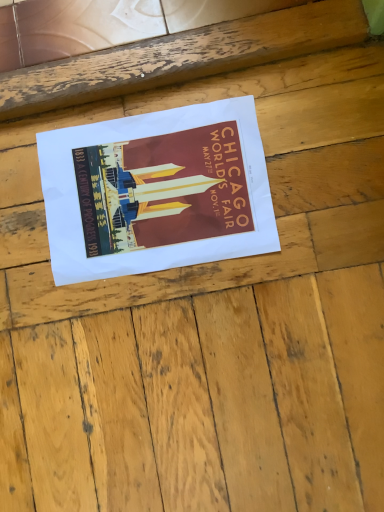
You are a GUI agent. You are given a task and a screenshot of the screen. Output one action in this format:
    pyautogui.click(x=<x>, y=<y>)
    Task: Click on the matte paper poster at center
    This screenshot has height=512, width=384.
    Given the screenshot: What is the action you would take?
    pyautogui.click(x=156, y=191)

The height and width of the screenshot is (512, 384). Describe the element at coordinates (156, 191) in the screenshot. I see `matte paper poster at center` at that location.

What do you see at coordinates (203, 402) in the screenshot? This screenshot has height=512, width=384. I see `wooden at center` at bounding box center [203, 402].

The width and height of the screenshot is (384, 512). In order to click on wooden at center in this screenshot , I will do `click(203, 402)`.

What is the approximate height of wooden at center?

It is 1.77 centimeters.

You are a GUI agent. You are given a task and a screenshot of the screen. Output one action in this format:
    pyautogui.click(x=<x>, y=<y>)
    Task: Click on the matte paper poster at center
    This screenshot has width=384, height=512.
    Given the screenshot: What is the action you would take?
    pyautogui.click(x=156, y=191)

Looking at this image, is matte paper poster at center to the right of wooden at center from the viewer's perspective?

In fact, matte paper poster at center is to the left of wooden at center.

Which is in front, matte paper poster at center or wooden at center?

wooden at center is in front.

Considering the points (99, 207) and (234, 399), which point is in front, point (99, 207) or point (234, 399)?

Positioned in front is point (234, 399).

From the image's perspective, is matte paper poster at center above or below wooden at center?

Based on their image positions, matte paper poster at center is located above wooden at center.

From a real-world perspective, relative to wooden at center, is matte paper poster at center vertically above or below?

matte paper poster at center is below wooden at center.

Considering the relative sizes of matte paper poster at center and wooden at center in the image provided, is matte paper poster at center thinner than wooden at center?

Yes, matte paper poster at center is thinner than wooden at center.

Is matte paper poster at center shorter than wooden at center?

Yes, matte paper poster at center is shorter than wooden at center.

Which of these two, matte paper poster at center or wooden at center, is smaller?

matte paper poster at center.

Is matte paper poster at center outside of wooden at center?

No, matte paper poster at center is inside wooden at center's boundary.

Is matte paper poster at center far from wooden at center?

matte paper poster at center is actually quite close to wooden at center.

Is matte paper poster at center looking in the opposite direction of wooden at center?

Correct, matte paper poster at center is looking away from wooden at center.

How many degrees apart are the facing directions of matte paper poster at center and wooden at center?

There is a 0.711-degree angle between the facing directions of matte paper poster at center and wooden at center.

Where is `plywood below the matte paper poster at center (from the image's perspective)`? This screenshot has height=512, width=384. plywood below the matte paper poster at center (from the image's perspective) is located at coordinates (203, 402).

Considering the relative positions of wooden at center and matte paper poster at center in the image provided, is wooden at center to the right of matte paper poster at center from the viewer's perspective?

Yes, wooden at center is to the right of matte paper poster at center.

Consider the image. Which object is more forward, wooden at center or matte paper poster at center?

wooden at center is closer to the camera.

Which is in front, point (302, 281) or point (202, 244)?

The point (302, 281) is more forward.

From the image's perspective, which is above, wooden at center or matte paper poster at center?

matte paper poster at center is shown above in the image.

From a real-world perspective, who is located lower, wooden at center or matte paper poster at center?

In real-world perspective, matte paper poster at center is lower.

Looking at their sizes, would you say wooden at center is wider or thinner than matte paper poster at center?

Considering their sizes, wooden at center looks broader than matte paper poster at center.

Does wooden at center have a lesser height compared to matte paper poster at center?

Incorrect, the height of wooden at center does not fall short of that of matte paper poster at center.

Does wooden at center have a smaller size compared to matte paper poster at center?

No.

Is wooden at center not inside matte paper poster at center?

Yes, wooden at center is located beyond the bounds of matte paper poster at center.

Is there a large distance between wooden at center and matte paper poster at center?

No.

Based on the photo, is wooden at center facing away from matte paper poster at center?

Yes, matte paper poster at center is at the back of wooden at center.

What's the angular difference between wooden at center and matte paper poster at center's facing directions?

They differ by 0.711 degrees in their facing directions.

Locate an element on the screen. poster on the left side of wooden at center is located at coordinates (156, 191).

Where is `plywood above the matte paper poster at center (from a real-world perspective)`? plywood above the matte paper poster at center (from a real-world perspective) is located at coordinates (203, 402).

In order to click on plywood on the right of matte paper poster at center in this screenshot , I will do `click(203, 402)`.